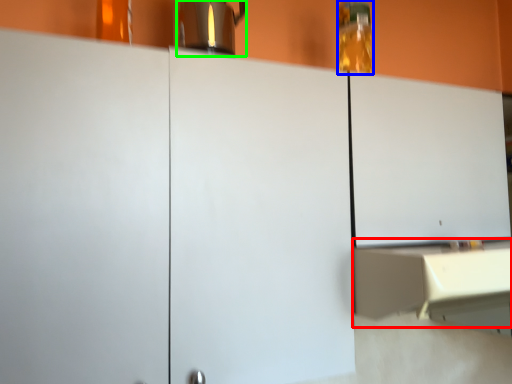
Question: Considering the real-world distances, which object is farthest from counter (highlighted by a red box)? bottle (highlighted by a blue box) or coffeepot (highlighted by a green box)?

Choices:
 (A) bottle
 (B) coffeepot

Answer: (B)